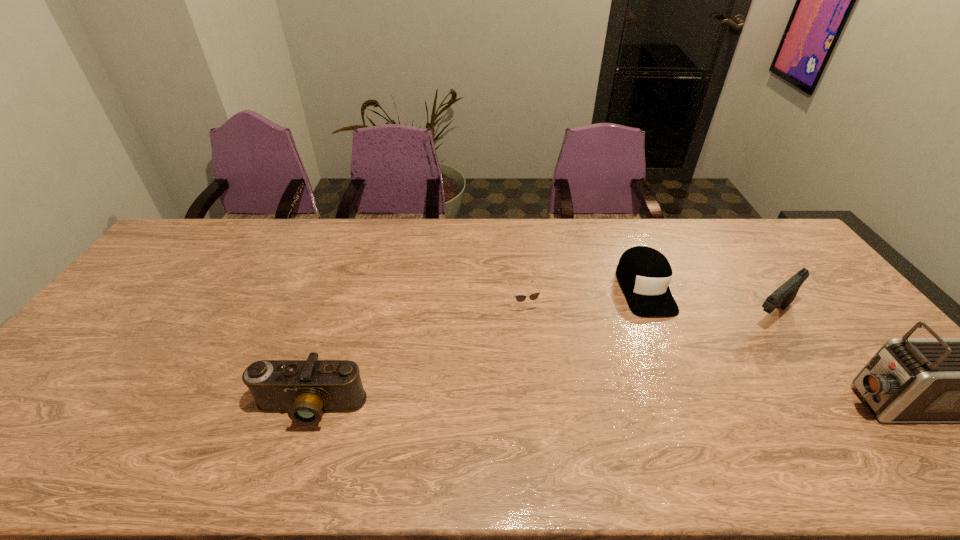
Locate an element on the screen. free space on the desktop that is between the leftmost object and the camcorder and is positioned on the front-facing side of the fourth tallest object is located at coordinates (696, 404).

At what (x,y) coordinates should I click in order to perform the action: click on vacant space on the desktop that is between the leftmost object and the tallest object and is positioned at the barrel of the pistol. Please return your answer as a coordinate pair (x, y). The image size is (960, 540). Looking at the image, I should click on (667, 405).

Find the location of a particular element. The height and width of the screenshot is (540, 960). vacant space on the desktop that is between the camera and the camcorder and is positioned in front of the lenses of the second object from left to right is located at coordinates (564, 406).